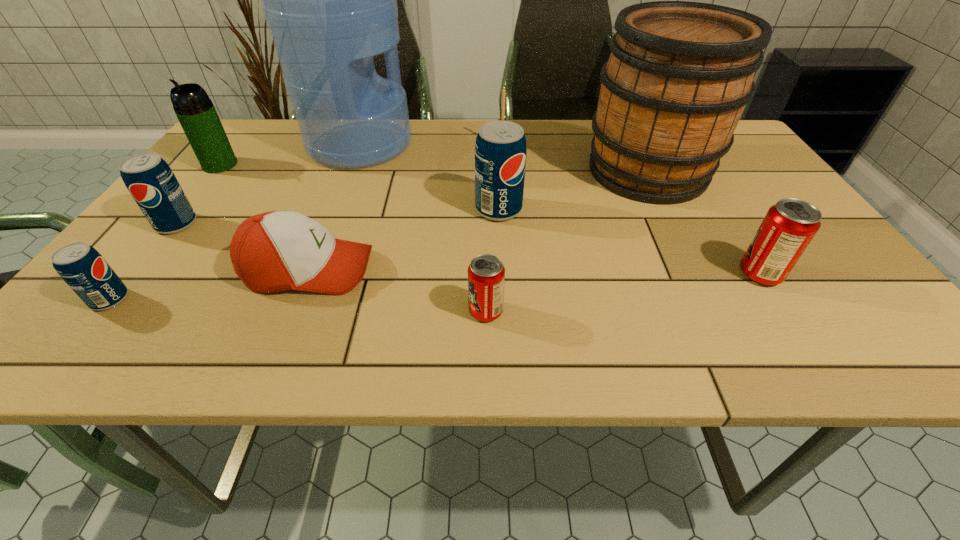
You are a GUI agent. You are given a task and a screenshot of the screen. Output one action in this format:
    pyautogui.click(x=<x>, y=<y>)
    Task: Click on the free space located on the front of the second smallest blue pop
    
    Given the screenshot: What is the action you would take?
    pyautogui.click(x=122, y=294)

You are a GUI agent. You are given a task and a screenshot of the screen. Output one action in this format:
    pyautogui.click(x=<x>, y=<y>)
    Task: Click on the free space located on the left of the farther red soda can
    The width and height of the screenshot is (960, 540).
    Given the screenshot: What is the action you would take?
    pyautogui.click(x=583, y=274)

You are a GUI agent. You are given a task and a screenshot of the screen. Output one action in this format:
    pyautogui.click(x=<x>, y=<y>)
    Task: Click on the vacant area situated 0.060m on the front-facing side of the baseball cap
    The width and height of the screenshot is (960, 540).
    Given the screenshot: What is the action you would take?
    pyautogui.click(x=404, y=270)

Find the location of a particular element. Image resolution: width=960 pixels, height=540 pixels. vacant space situated on the right of the smallest blue pop is located at coordinates (246, 299).

Where is `free region located on the left of the left red soda can`? This screenshot has height=540, width=960. free region located on the left of the left red soda can is located at coordinates (414, 311).

Identify the location of water jug that is positioned at the far edge. This screenshot has width=960, height=540. (330, 0).

Where is `cider positioned at the far edge`? cider positioned at the far edge is located at coordinates (680, 73).

Locate an element on the screen. The image size is (960, 540). thermos bottle located in the far edge section of the desktop is located at coordinates (195, 111).

You are a GUI agent. You are given a task and a screenshot of the screen. Output one action in this format:
    pyautogui.click(x=<x>, y=<y>)
    Task: Click on the candle_holder located in the far edge section of the desktop
    This screenshot has height=540, width=960.
    Given the screenshot: What is the action you would take?
    pyautogui.click(x=503, y=91)

Locate an element on the screen. The height and width of the screenshot is (540, 960). object that is at the near edge is located at coordinates (486, 274).